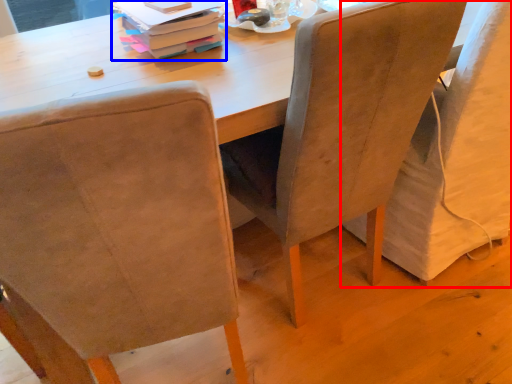
Question: Which point is closer to the camera, chair (highlighted by a red box) or book (highlighted by a blue box)?

Choices:
 (A) chair
 (B) book

Answer: (A)